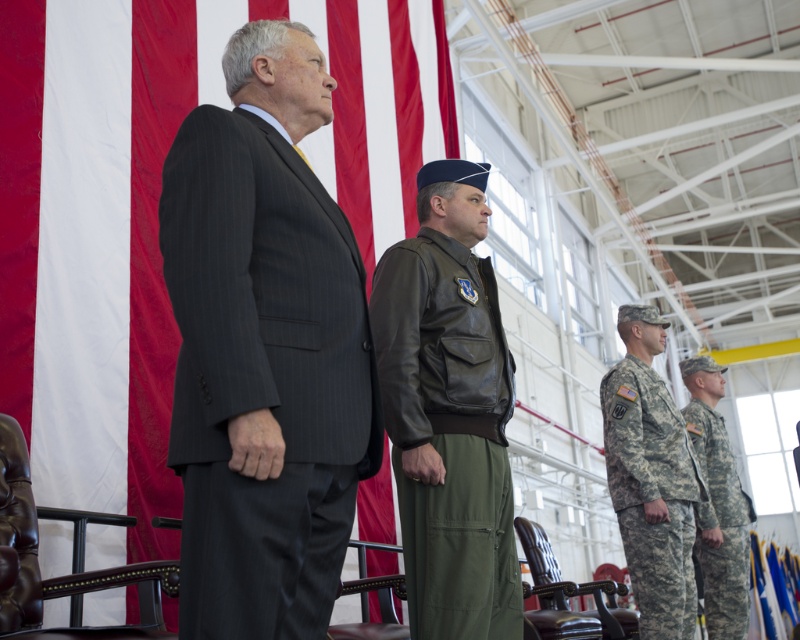
You are a photographer positioned at the center of the scene. You need to capture a photo that includes both the dark gray pinstripe suit at center and the camouflage uniform at right. What is the minimum distance you need to move backward to ensure both subjects are fully in frame?

The dark gray pinstripe suit at center is 9.35 feet away from the camouflage uniform at right. To include both in the frame, you need to move backward at least half of that distance, which is approximately 4.675 feet, to ensure both subjects are fully visible.